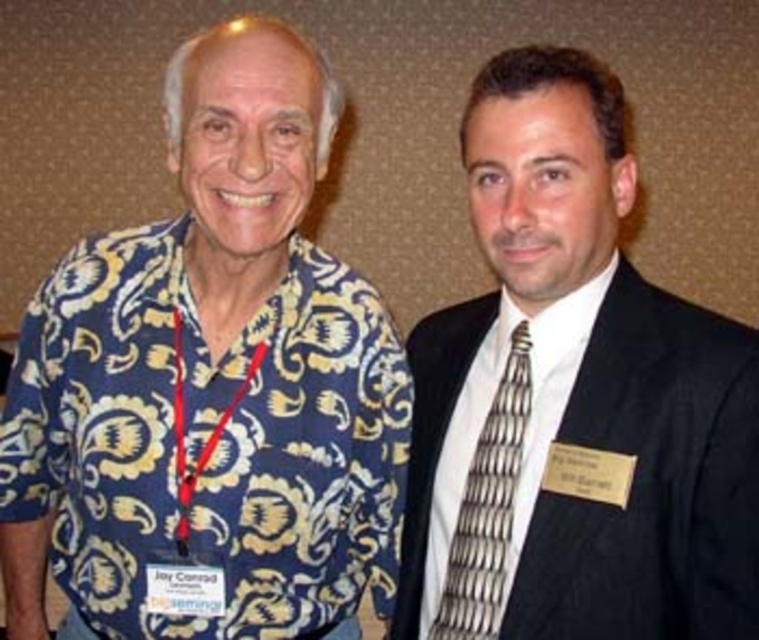
You are an event planner trying to arrange seating for a photo shoot. You need to place a chair exactly at the coordinates where the black suit at right is located. What are the coordinates you should use?

The coordinates for the black suit at right are at point (572, 400), so you should place the chair at those coordinates.

You are taking a photo of two people standing in front of you. You notice two points marked on their clothing, one at point (619, 492) and the other at point (496, 602). Which point is closer to your camera?

Point (619, 492) is closer to the camera than point (496, 602).